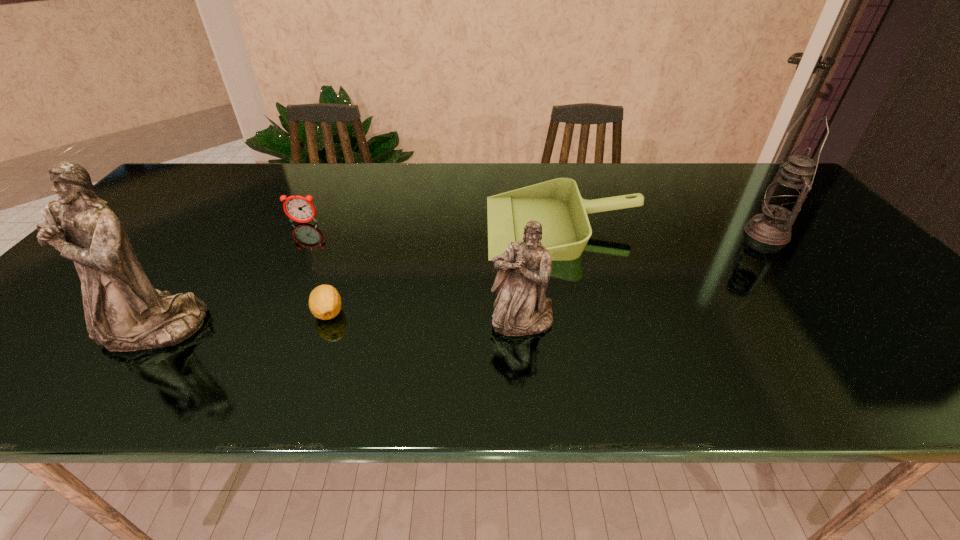
Find the location of a particular element. The height and width of the screenshot is (540, 960). free region at the left edge of the desktop is located at coordinates (80, 285).

The image size is (960, 540). I want to click on vacant point at the right edge, so click(900, 303).

Image resolution: width=960 pixels, height=540 pixels. I want to click on free region at the far right corner of the desktop, so click(x=741, y=177).

At what (x,y) coordinates should I click in order to perform the action: click on vacant space at the near right corner of the desktop. Please return your answer as a coordinate pair (x, y). Looking at the image, I should click on [933, 345].

The width and height of the screenshot is (960, 540). In order to click on vacant area that lies between the leftmost object and the third tallest object in this screenshot , I will do `click(337, 325)`.

The image size is (960, 540). Identify the location of unoccupied area between the dustpan and the second tallest object. (664, 230).

Locate an element on the screen. This screenshot has width=960, height=540. vacant point located between the fourth shortest object and the alarm clock is located at coordinates (413, 272).

The width and height of the screenshot is (960, 540). What are the coordinates of `empty location between the shorter figurine and the second tallest object` in the screenshot? It's located at (644, 277).

You are a GUI agent. You are given a task and a screenshot of the screen. Output one action in this format:
    pyautogui.click(x=<x>, y=<y>)
    Task: Click on the free area in between the fifth object from right to left and the fourth object from right to left
    
    Given the screenshot: What is the action you would take?
    pyautogui.click(x=316, y=268)

Find the location of `empty space that is in between the shorter figurine and the alarm clock`. empty space that is in between the shorter figurine and the alarm clock is located at coordinates (413, 272).